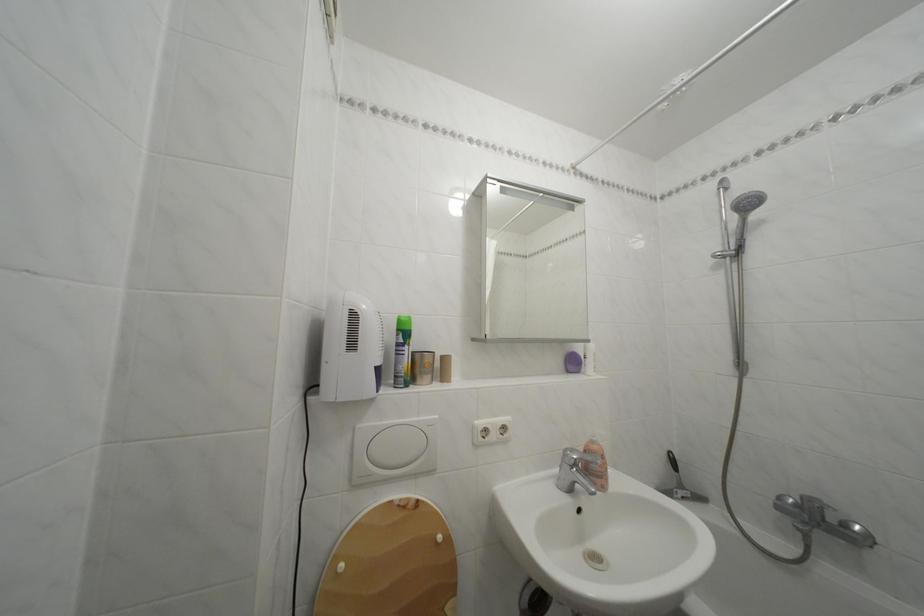
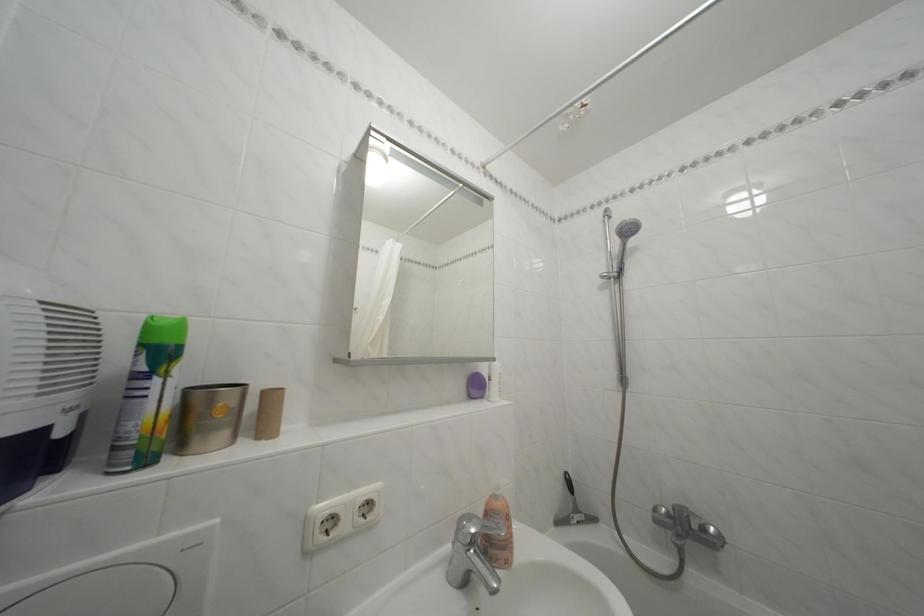
What movement of the cameraman would produce the second image?

The movement direction of the cameraman is right, forward.